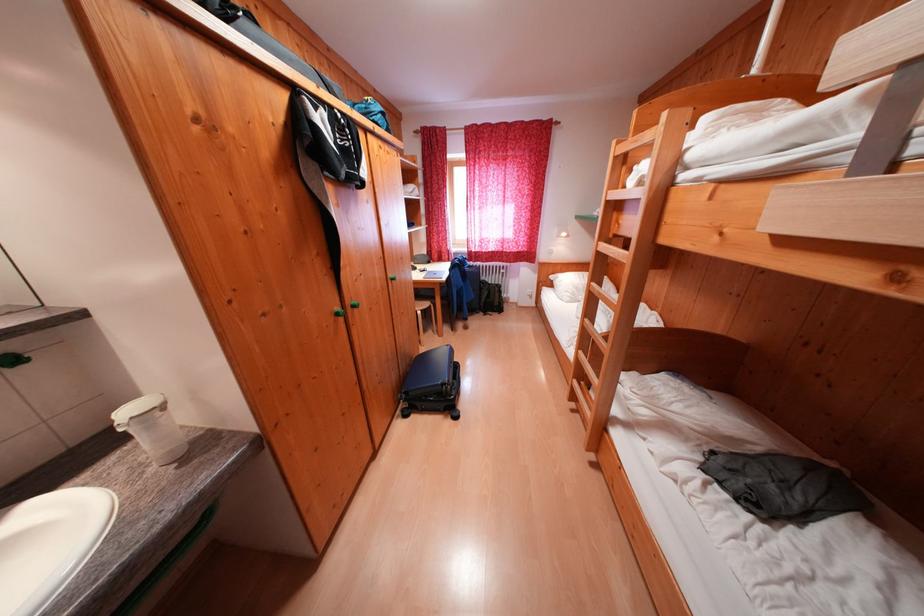
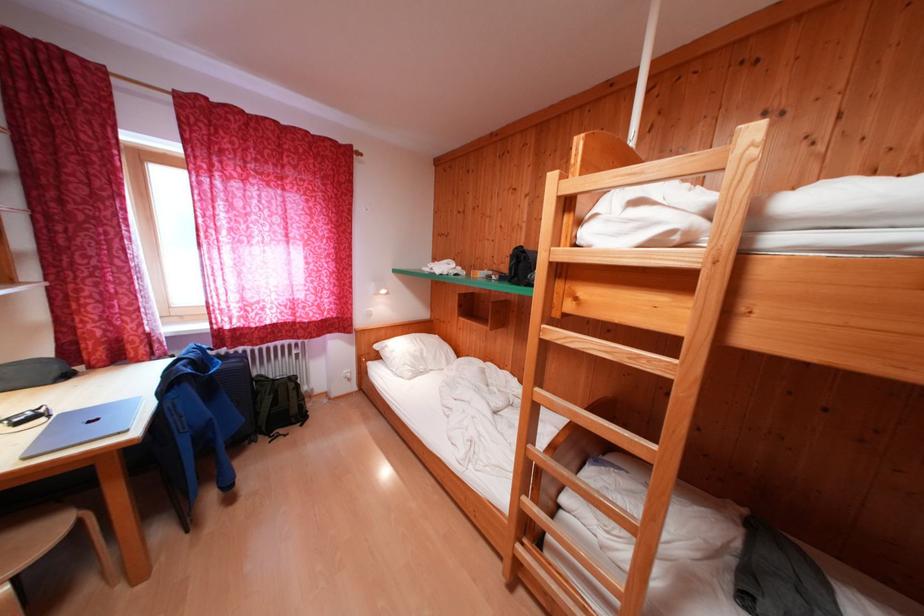
In the second image, find the point that corresponds to [444,281] in the first image.

(104, 434)